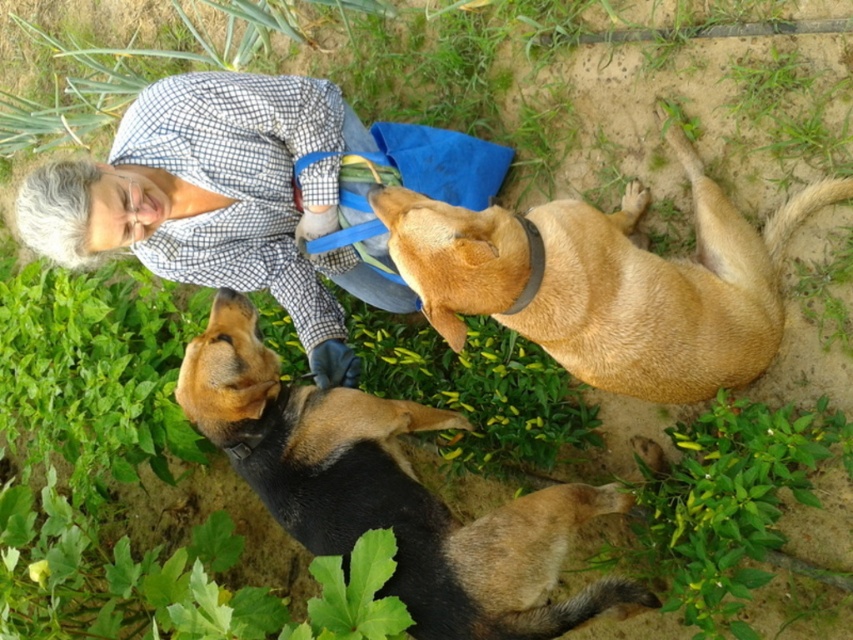
Does black fur dog at lower center appear over checkered fabric shirt at upper left?

No, black fur dog at lower center is not above checkered fabric shirt at upper left.

Is point (593, 500) in front of point (154, 90)?

No, it is not.

What are the coordinates of `black fur dog at lower center` in the screenshot? It's located at (389, 492).

Who is positioned more to the right, golden fur dog at center or checkered fabric shirt at upper left?

Positioned to the right is golden fur dog at center.

Can you confirm if golden fur dog at center is positioned to the left of checkered fabric shirt at upper left?

In fact, golden fur dog at center is to the right of checkered fabric shirt at upper left.

The image size is (853, 640). I want to click on golden fur dog at center, so click(608, 282).

What do you see at coordinates (608, 282) in the screenshot? I see `golden fur dog at center` at bounding box center [608, 282].

Is point (596, 298) behind point (596, 509)?

No, it is not.

Does point (527, 256) come closer to viewer compared to point (608, 580)?

Yes, point (527, 256) is in front of point (608, 580).

At what (x,y) coordinates should I click in order to perform the action: click on golden fur dog at center. Please return your answer as a coordinate pair (x, y). This screenshot has height=640, width=853. Looking at the image, I should click on (608, 282).